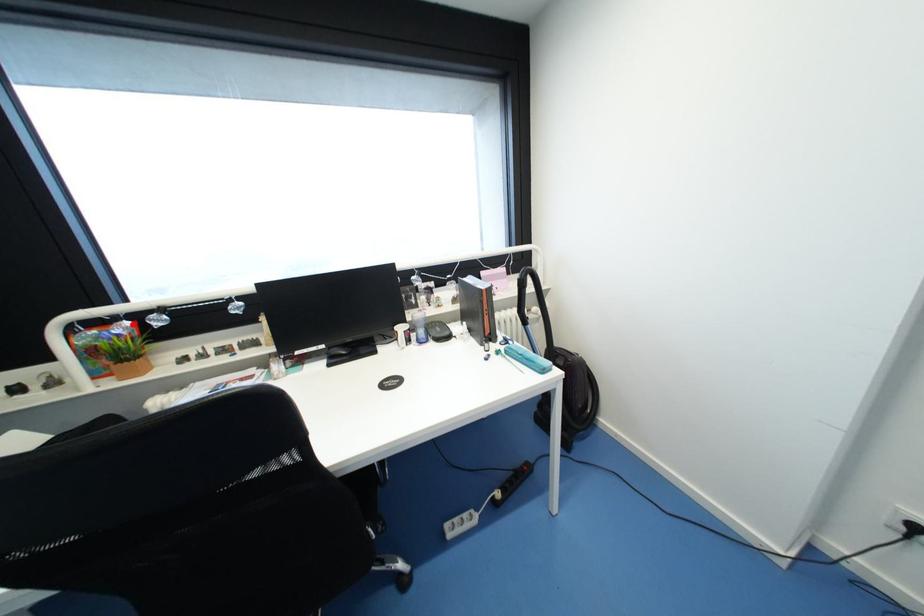
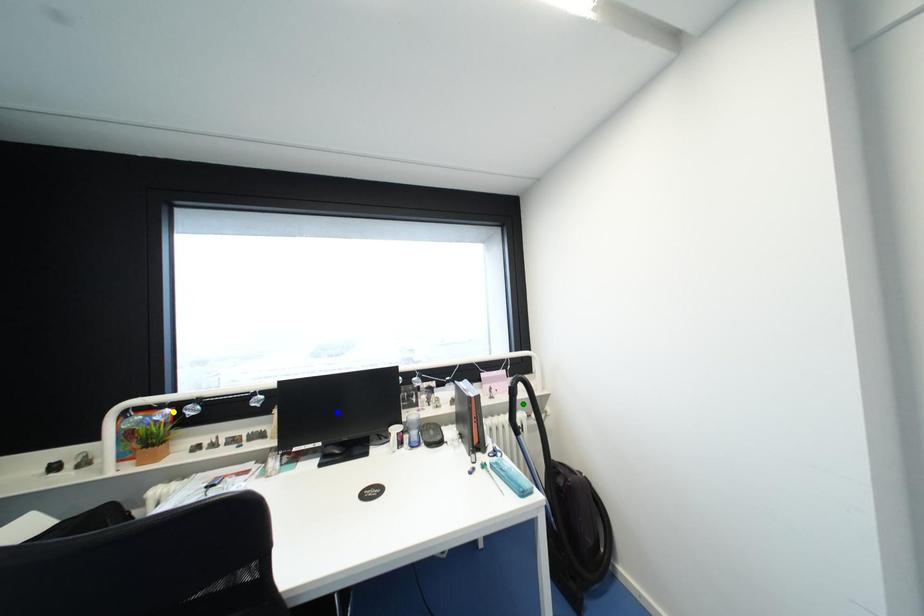
Question: I am providing you with two images of the same scene from different viewpoints. A red point is marked on the first image. You are given multiple points on the second image. Which spot in image 2 lines up with the point in image 1?

Choices:
 (A) green point
 (B) yellow point
 (C) blue point

Answer: (B)